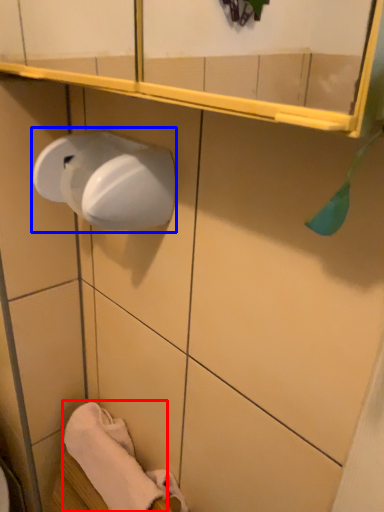
Question: Which point is further to the camera, bath towel (highlighted by a red box) or paper towel (highlighted by a blue box)?

Choices:
 (A) bath towel
 (B) paper towel

Answer: (A)